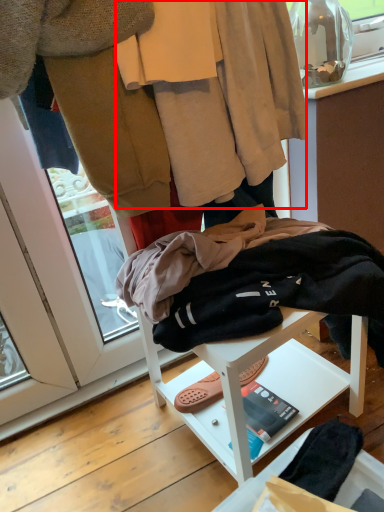
Question: From the image's perspective, where is robe (annotated by the red box) located in relation to furniture in the image?

Choices:
 (A) below
 (B) above

Answer: (B)